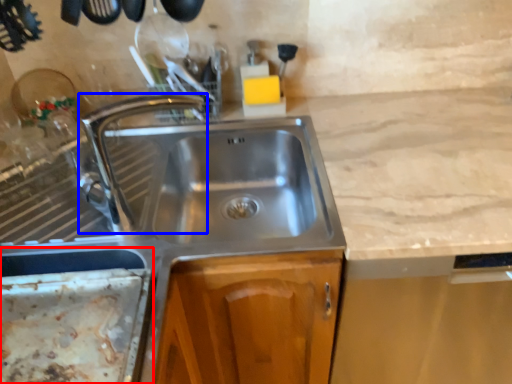
Question: Which object appears closest to the camera in this image, appliance (highlighted by a red box) or tap (highlighted by a blue box)?

Choices:
 (A) appliance
 (B) tap

Answer: (A)